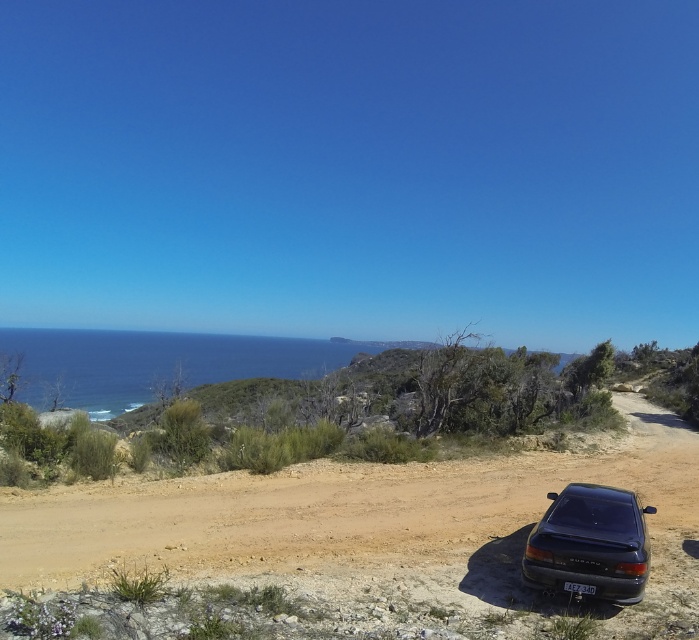
Question: Does brown dirt track at center appear on the left side of glossy black car at lower right?

Choices:
 (A) yes
 (B) no

Answer: (B)

Question: Does glossy black car at lower right have a lesser width compared to black plastic license plate at lower center?

Choices:
 (A) no
 (B) yes

Answer: (A)

Question: Among these objects, which one is farthest from the camera?

Choices:
 (A) black plastic license plate at lower center
 (B) glossy black car at lower right
 (C) brown dirt track at center

Answer: (A)

Question: Which object is positioned closest to the brown dirt track at center?

Choices:
 (A) black plastic license plate at lower center
 (B) glossy black car at lower right

Answer: (B)

Question: From the image, what is the correct spatial relationship of brown dirt track at center in relation to glossy black car at lower right?

Choices:
 (A) below
 (B) above

Answer: (A)

Question: Which of the following is the farthest from the observer?

Choices:
 (A) (583, 588)
 (B) (540, 582)
 (C) (675, 474)

Answer: (C)